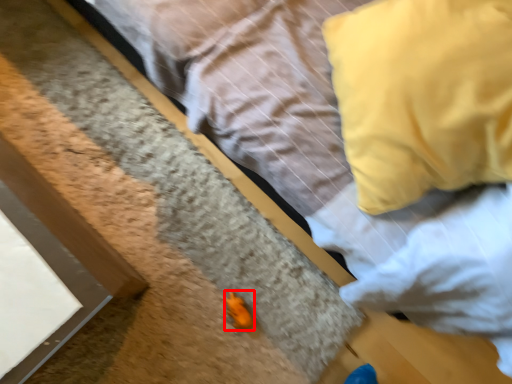
Question: From the image's perspective, what is the correct spatial positioning of miniature (annotated by the red box) in reference to pillow?

Choices:
 (A) below
 (B) above

Answer: (A)